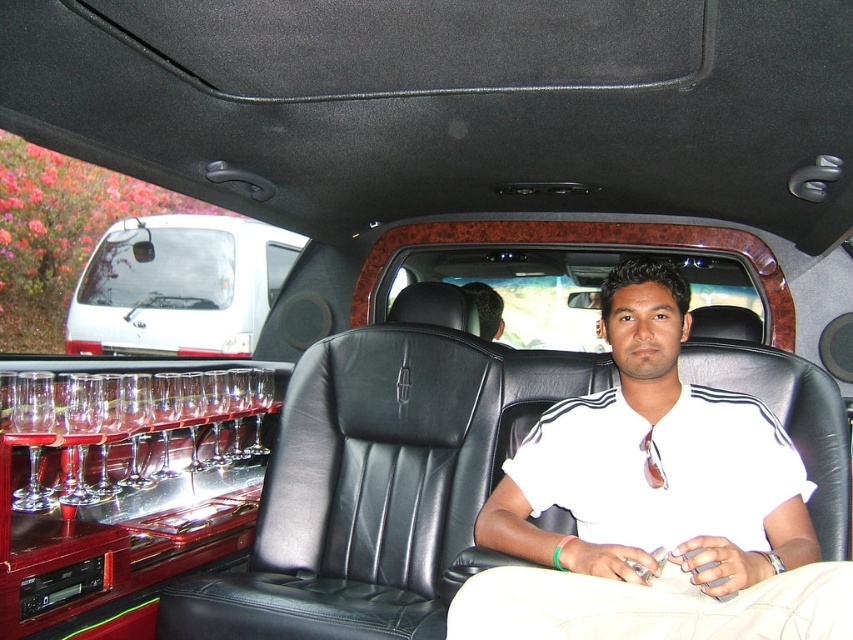
You are a passenger in the luxurious limousine and want to reach for the clear glass wine glass at left and the white glossy minivan at upper left. Which object is closer to you from your seated position?

The clear glass wine glass at left is closer to you than the white glossy minivan at upper left because it is located below it.

You are a passenger in the limousine and want to reach for the clear glass wine glass at left while keeping an eye on the white glossy minivan at upper left. How far apart are these two items from your perspective?

The clear glass wine glass at left and the white glossy minivan at upper left are 6.28 feet apart.